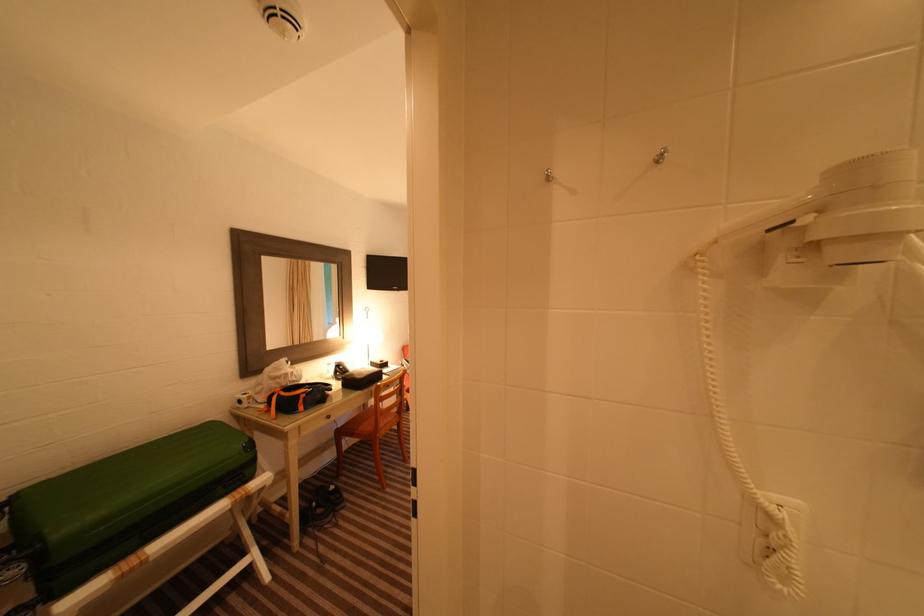
Where is `orange bag handle`? orange bag handle is located at coordinates [x=286, y=399].